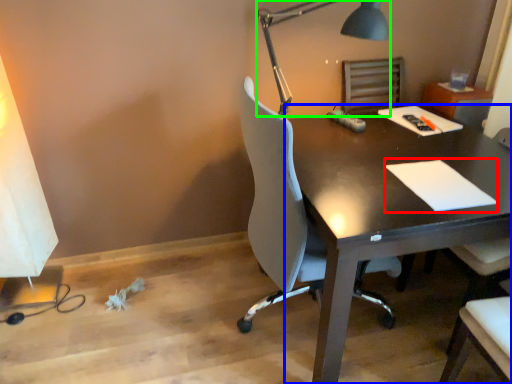
Question: Estimate the real-world distances between objects in this image. Which object is closer to notepad (highlighted by a red box), desk (highlighted by a blue box) or lamp (highlighted by a green box)?

Choices:
 (A) desk
 (B) lamp

Answer: (A)